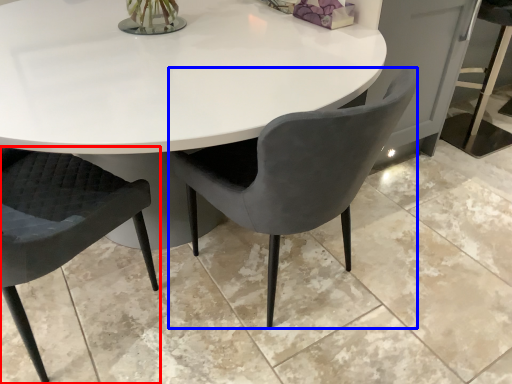
Question: Which object is closer to the camera taking this photo, chair (highlighted by a red box) or chair (highlighted by a blue box)?

Choices:
 (A) chair
 (B) chair

Answer: (A)